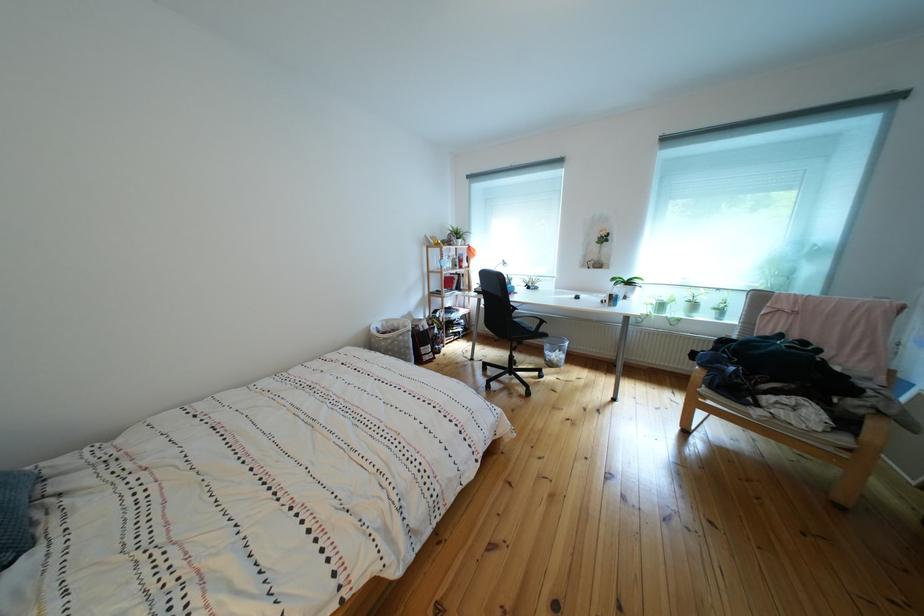
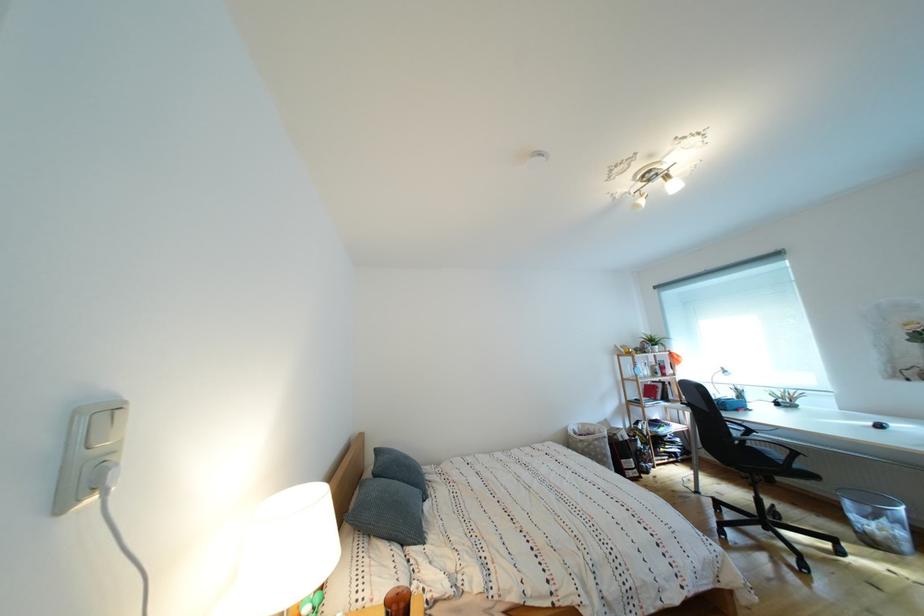
Where in the second image is the point corresponding to the point at 458,275 from the first image?

(657, 383)